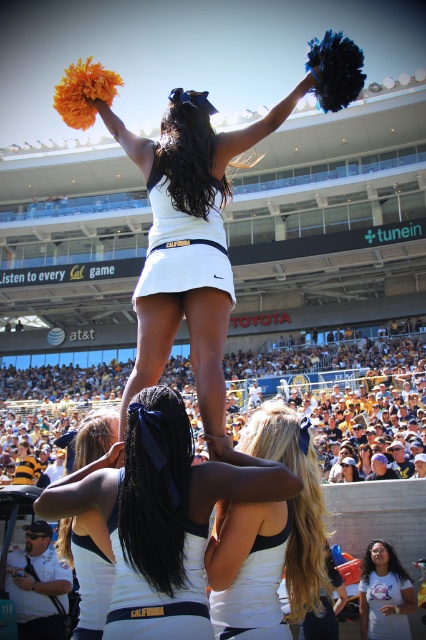
Question: Estimate the real-world distances between objects in this image. Which object is farther from the white matte cheerleader at center?

Choices:
 (A) white matte tank top at center
 (B) white matte uniform at center

Answer: (A)

Question: Which point is farther to the camera?

Choices:
 (A) (405, 620)
 (B) (86, 557)

Answer: (A)

Question: Considering the relative positions of white plastic cups at center and white matte tank top at center in the image provided, where is white plastic cups at center located with respect to white matte tank top at center?

Choices:
 (A) above
 (B) below

Answer: (A)

Question: Does white plastic cups at center appear on the right side of white matte t-shirt at lower right?

Choices:
 (A) no
 (B) yes

Answer: (A)

Question: Can you confirm if white plastic cups at center is positioned above white matte cheerleader at center?

Choices:
 (A) no
 (B) yes

Answer: (B)

Question: Among these objects, which one is farthest from the camera?

Choices:
 (A) white matte tank top at center
 (B) white matte t-shirt at lower right
 (C) white matte uniform at center
 (D) white matte cheerleader at center

Answer: (B)